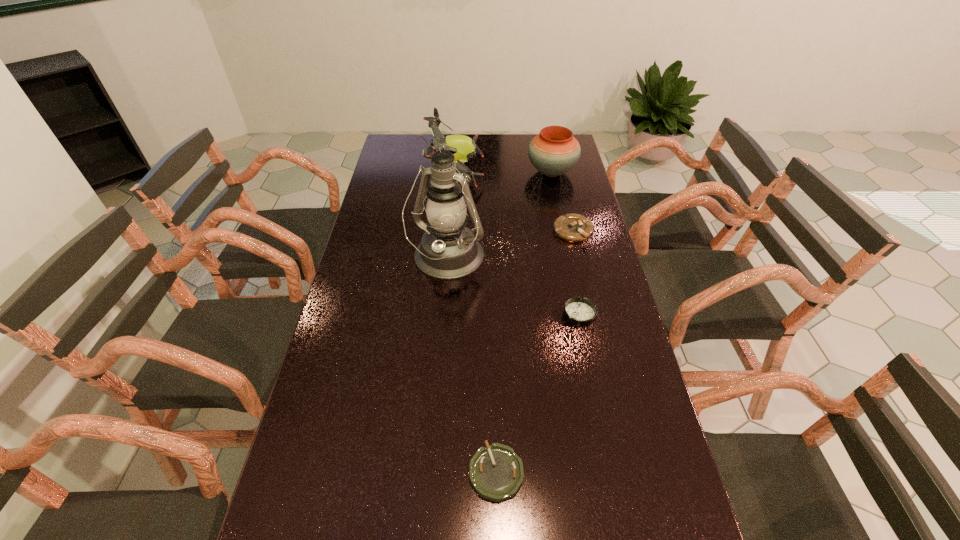
I want to click on oil lamp, so click(449, 250).

This screenshot has height=540, width=960. Find the location of `the second tallest object`. the second tallest object is located at coordinates (462, 147).

Identify the location of pottery. Image resolution: width=960 pixels, height=540 pixels. (553, 152).

At what (x,y) coordinates should I click in order to perform the action: click on the fourth tallest object. Please return your answer as a coordinate pair (x, y). The height and width of the screenshot is (540, 960). Looking at the image, I should click on (575, 228).

You are a GUI agent. You are given a task and a screenshot of the screen. Output one action in this format:
    pyautogui.click(x=<x>, y=<y>)
    Task: Click on the farthest ashtray
    Image resolution: width=960 pixels, height=540 pixels.
    Given the screenshot: What is the action you would take?
    coord(575,228)

This screenshot has width=960, height=540. Identify the location of the fifth farthest object. (581, 312).

Where is `the second tallest ashtray`? The image size is (960, 540). the second tallest ashtray is located at coordinates (581, 312).

What are the coordinates of `the leftmost ashtray` in the screenshot? It's located at (496, 473).

Identify the location of the shortest object. The width and height of the screenshot is (960, 540). (496, 473).

Locate an element on the screen. The width and height of the screenshot is (960, 540). vacant space located on the back of the tallest object is located at coordinates (450, 223).